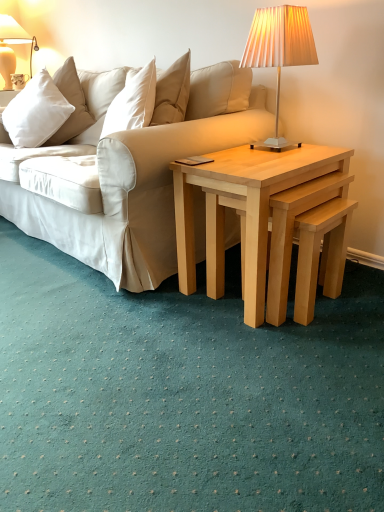
The height and width of the screenshot is (512, 384). Find the location of `vacant area situated below matte cream lampshade at upper right, marked as the 2th lamp in a left-to-right arrangement (from a real-world perspective)`. vacant area situated below matte cream lampshade at upper right, marked as the 2th lamp in a left-to-right arrangement (from a real-world perspective) is located at coordinates pyautogui.click(x=277, y=148).